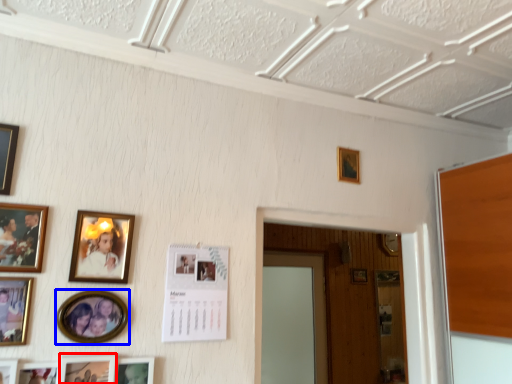
Question: Which point is closer to the camera, picture frame (highlighted by a red box) or picture frame (highlighted by a blue box)?

Choices:
 (A) picture frame
 (B) picture frame

Answer: (A)